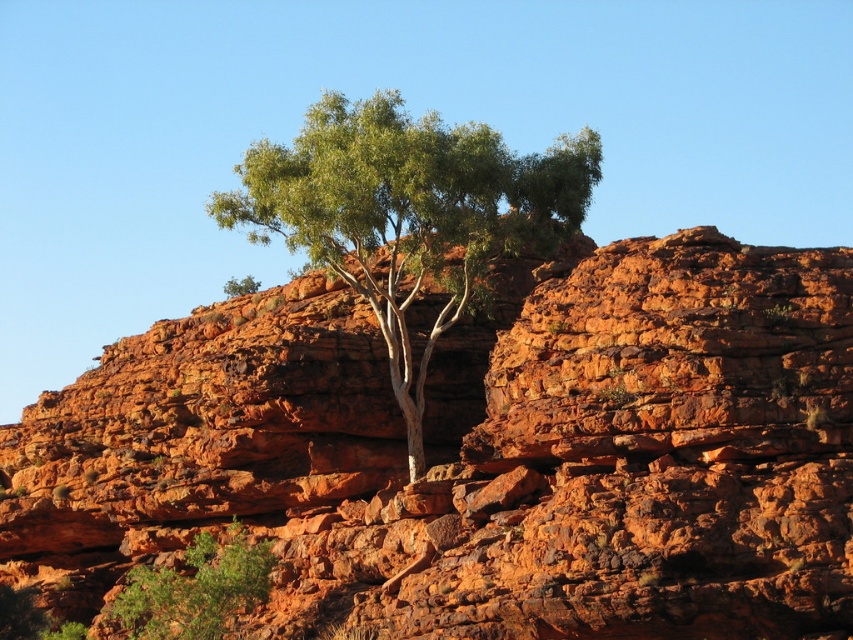
Question: Which object appears farthest from the camera in this image?

Choices:
 (A) rusty rock at center
 (B) green leafy tree at center

Answer: (B)

Question: From the image, what is the correct spatial relationship of rusty rock at center in relation to green leafy tree at center?

Choices:
 (A) above
 (B) below

Answer: (B)

Question: Is rusty rock at center to the left of green leafy tree at center from the viewer's perspective?

Choices:
 (A) no
 (B) yes

Answer: (B)

Question: Based on their relative distances, which object is nearer to the rusty rock at center?

Choices:
 (A) green leafy tree at lower left
 (B) green leafy tree at center

Answer: (A)

Question: Which object is closer to the camera taking this photo?

Choices:
 (A) green leafy tree at lower left
 (B) green leafy tree at center
 (C) rusty rock at center

Answer: (C)

Question: Considering the relative positions of green leafy tree at center and green leafy tree at lower left in the image provided, where is green leafy tree at center located with respect to green leafy tree at lower left?

Choices:
 (A) above
 (B) below

Answer: (A)